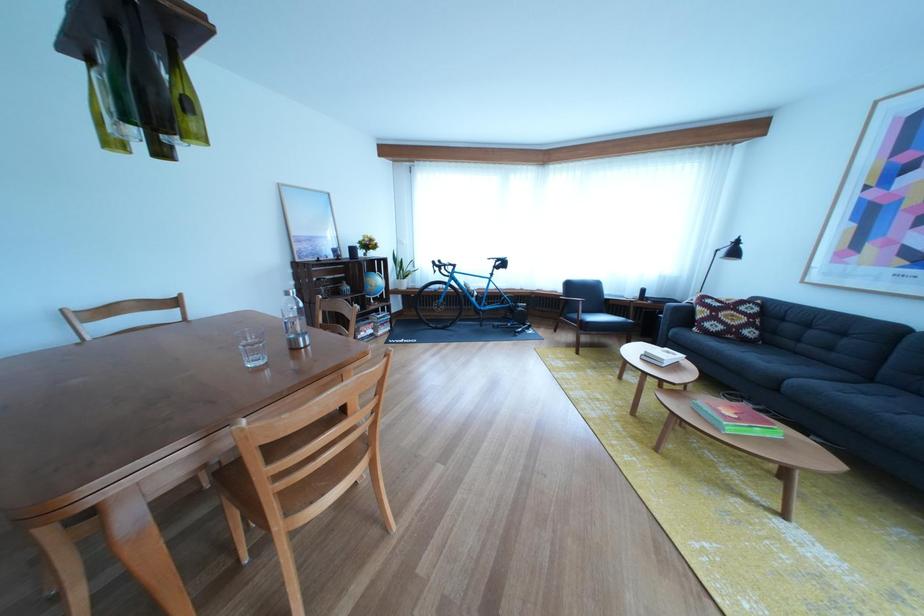
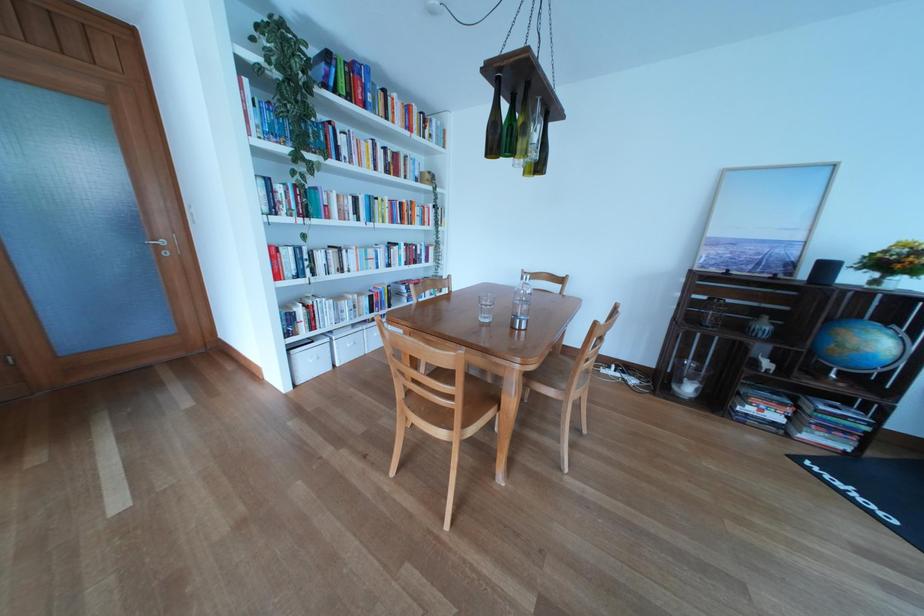
Find the pixel in the second image that matches (x=382, y=285) in the first image.

(855, 337)